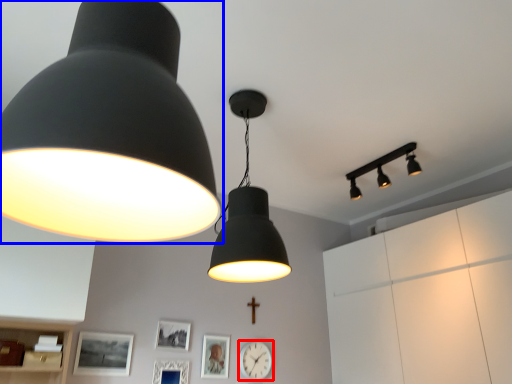
Question: Which object is closer to the camera taking this photo, clock (highlighted by a red box) or lamp (highlighted by a blue box)?

Choices:
 (A) clock
 (B) lamp

Answer: (B)